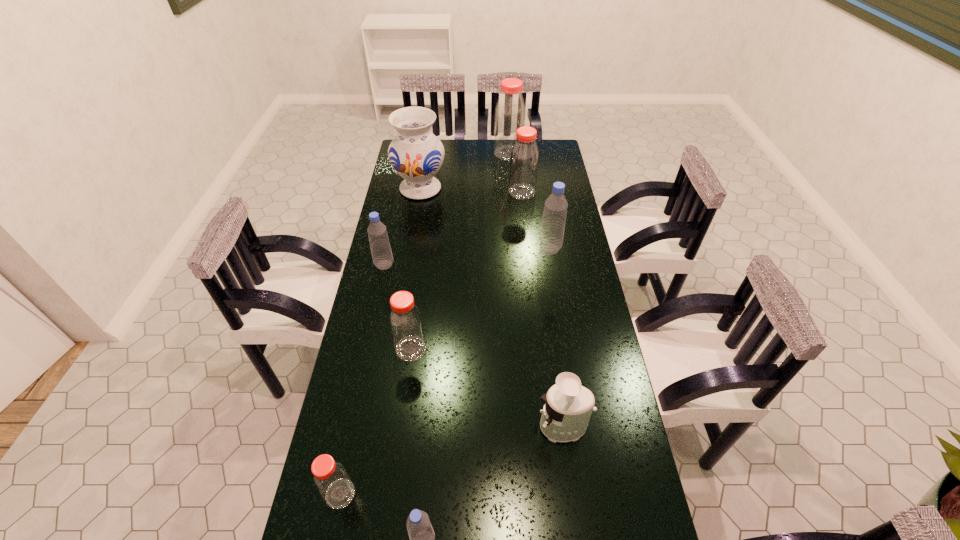
The width and height of the screenshot is (960, 540). Find the location of `the third bottle from left to right`. the third bottle from left to right is located at coordinates pos(405,320).

The height and width of the screenshot is (540, 960). I want to click on juicer, so click(568, 406).

Where is `the leftmost red bottle`? The image size is (960, 540). the leftmost red bottle is located at coordinates (332, 481).

I want to click on the eighth farthest object, so click(332, 481).

In order to click on vacant space situated 0.110m on the front of the farthest bottle in this screenshot , I will do `click(510, 174)`.

The width and height of the screenshot is (960, 540). I want to click on free space located on the right of the vase, so click(x=458, y=189).

The height and width of the screenshot is (540, 960). In order to click on free location located 0.350m on the front of the sixth nearest object in this screenshot , I will do `click(563, 329)`.

At what (x,y) coordinates should I click in order to perform the action: click on free space located 0.070m on the front of the third smallest red bottle. Please return your answer as a coordinate pair (x, y). The height and width of the screenshot is (540, 960). Looking at the image, I should click on (524, 210).

Identify the location of free space located on the front of the second farthest blue bottle. This screenshot has width=960, height=540. (367, 347).

Locate an element on the screen. This screenshot has width=960, height=540. free space located 0.310m on the front of the second nearest red bottle is located at coordinates tap(396, 463).